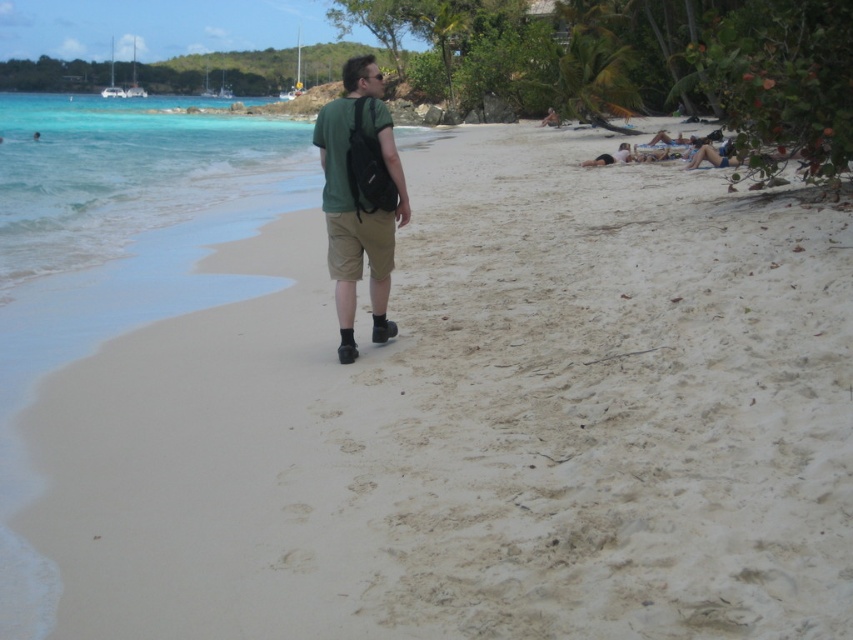
Question: Based on their relative distances, which object is farther from the smooth tan skin at upper right?

Choices:
 (A) green matte t-shirt at center
 (B) matte green t-shirt at upper center

Answer: (B)

Question: Which of the following is the farthest from the observer?

Choices:
 (A) matte green t-shirt at upper center
 (B) matte black shirt at center

Answer: (A)

Question: Is green matte t-shirt at center wider than matte black shirt at center?

Choices:
 (A) yes
 (B) no

Answer: (B)

Question: Estimate the real-world distances between objects in this image. Which object is closer to the green matte t-shirt at center?

Choices:
 (A) smooth tan skin at upper right
 (B) matte black shirt at center
 (C) matte green t-shirt at upper center

Answer: (A)

Question: Does green matte t-shirt at center come behind matte black shirt at center?

Choices:
 (A) no
 (B) yes

Answer: (A)

Question: Is the position of green matte t-shirt at center more distant than that of smooth tan skin at upper right?

Choices:
 (A) yes
 (B) no

Answer: (B)